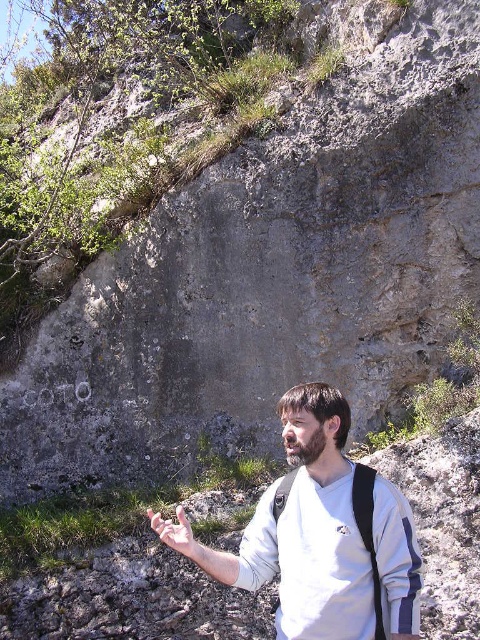
Looking at this image, you are a photographer trying to capture a portrait of the man in the scene. You need to ensure that both the white matte shirt at center and the smooth skin hand at lower center are in focus. Given that your camera has a depth of field that can cover 25 inches, will both objects be in focus?

The white matte shirt at center is 26.17 inches away from the smooth skin hand at lower center. Since the depth of field can only cover 25 inches, the distance between them exceeds the camera s capability, so both objects cannot be in focus simultaneously.

You are a photographer aiming to capture the man in the scene. If you focus on the white matte shirt at center and the smooth skin hand at lower center, which object should you adjust your camera to focus on first if you want to ensure both are in focus?

The white matte shirt at center is above the smooth skin hand at lower center, so you should focus on the white matte shirt at center first to ensure both are in focus.

You are a hiker trying to navigate between two points marked on the rock face. The points are labeled as point (396, 611) and point (159, 522). Which point is nearer to your current position if you are standing at the base of the rock face?

Point (396, 611) is closer to the viewer than point (159, 522), so the hiker should aim for point (396, 611) as it is nearer to their current position at the base of the rock face.